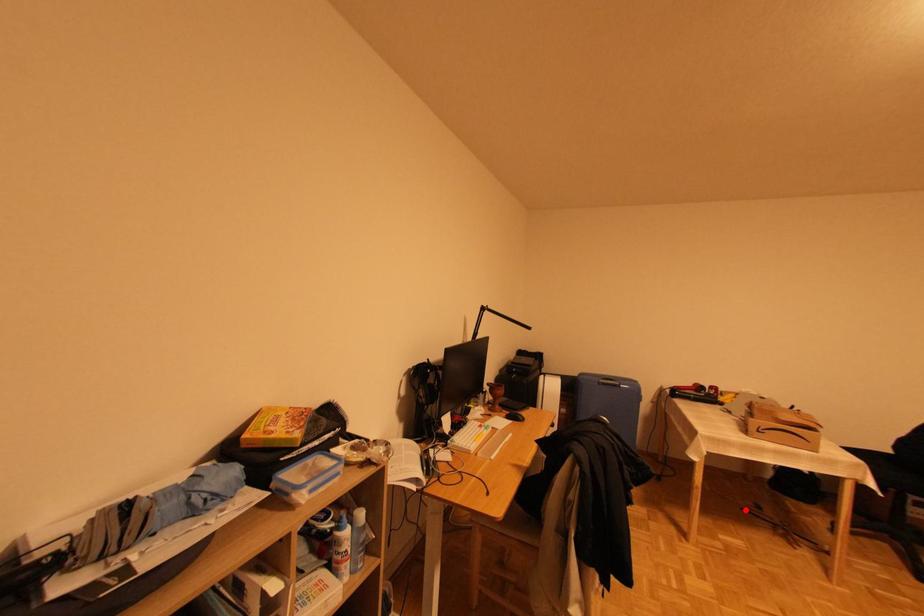
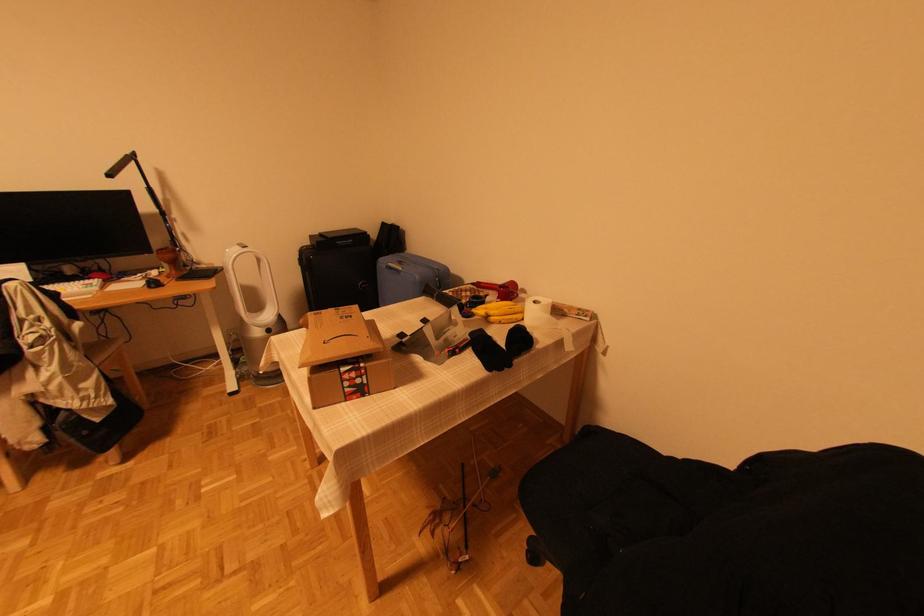
Question: I am providing you with two images of the same scene from different viewpoints. A red point is shown in image1. For the corresponding object point in image2, is it positioned nearer or farther from the camera?

Choices:
 (A) Nearer
 (B) Farther

Answer: (B)